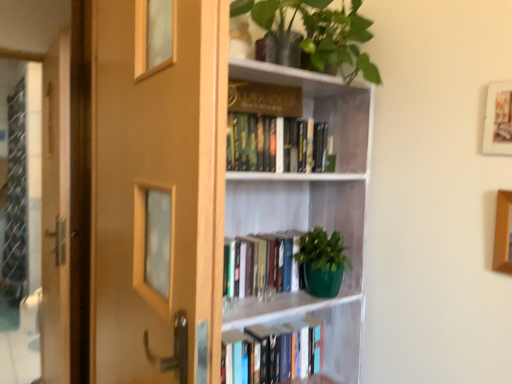
Question: Does point (501, 269) appear closer or farther from the camera than point (288, 152)?

Choices:
 (A) closer
 (B) farther

Answer: (A)

Question: Is wooden picture frame at upper right, which is the 1th picture frame in bottom-to-top order, situated inside hardcover books at upper center, which is counted as the second book, starting from the top, or outside?

Choices:
 (A) inside
 (B) outside

Answer: (B)

Question: Which object is the closest to the wooden screen door at left?

Choices:
 (A) green matte book at center, which is the 3th book from top to bottom
 (B) gold hardcover book at upper center, which appears as the first book when viewed from the top
 (C) wooden door at left
 (D) hardcover book at center, acting as the 1th book starting from the bottom
 (E) white matte bookcase at center

Answer: (C)

Question: Which object is positioned farthest from the wooden framed picture at upper right, the second picture frame in the bottom-to-top sequence?

Choices:
 (A) white matte bookcase at center
 (B) green matte book at center, which is the 3th book from top to bottom
 (C) wooden door at left
 (D) hardcover books at upper center, which is the 3th book in bottom-to-top order
 (E) wooden picture frame at upper right, which is the 1th picture frame in bottom-to-top order

Answer: (C)